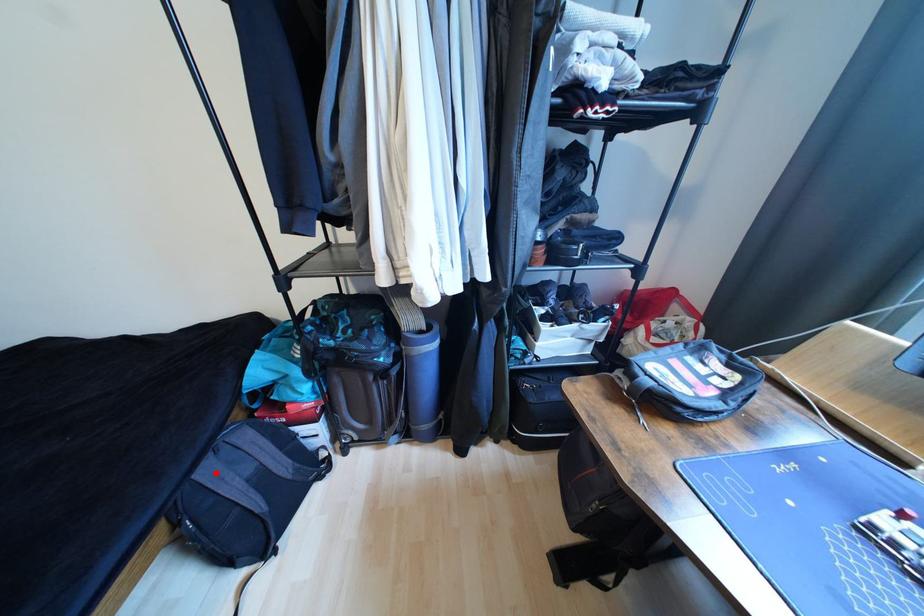
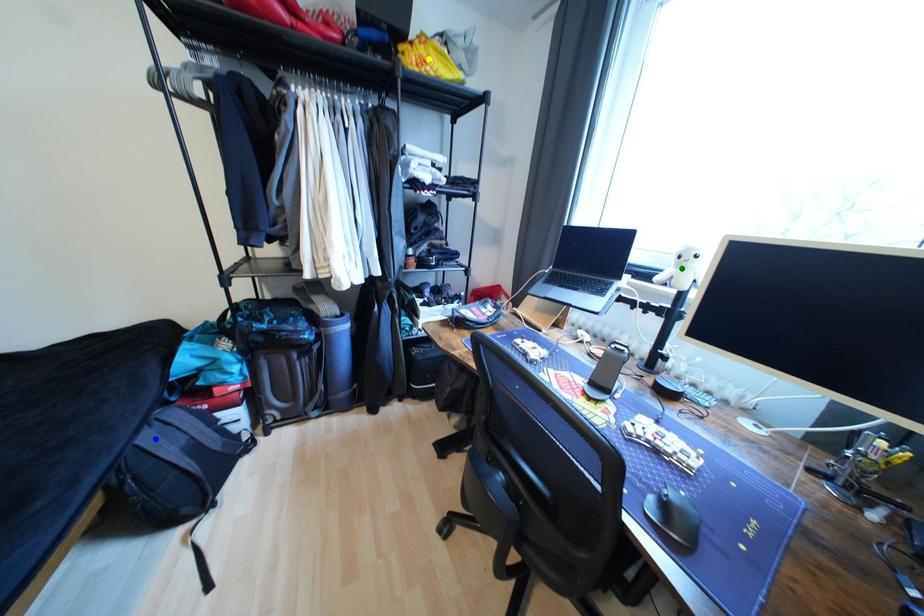
Question: I am providing you with two images of the same scene from different viewpoints. A red point is marked on the first image. You are given multiple points on the second image. In image 2, which mark is for the same physical point as the one in image 1?

Choices:
 (A) yellow point
 (B) green point
 (C) blue point

Answer: (C)